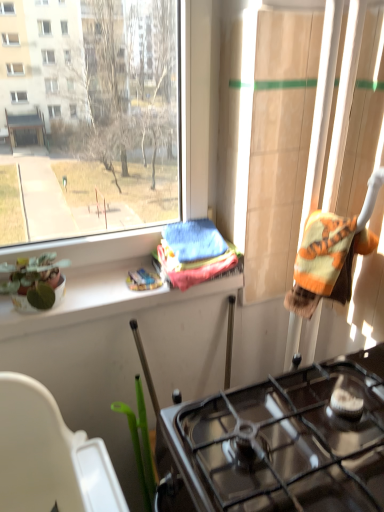
You are a GUI agent. You are given a task and a screenshot of the screen. Output one action in this format:
    pyautogui.click(x=<x>, y=<y>)
    Task: Click on the unoccupied region to the right of green glossy plant pot at lower left
    
    Given the screenshot: What is the action you would take?
    pyautogui.click(x=98, y=287)